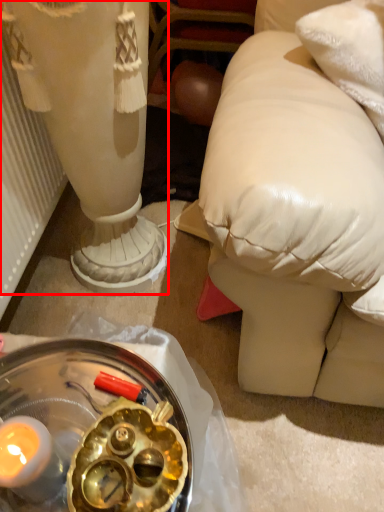
Question: From the image's perspective, what is the correct spatial relationship of sculpture (annotated by the red box) in relation to glass plate?

Choices:
 (A) above
 (B) below

Answer: (A)